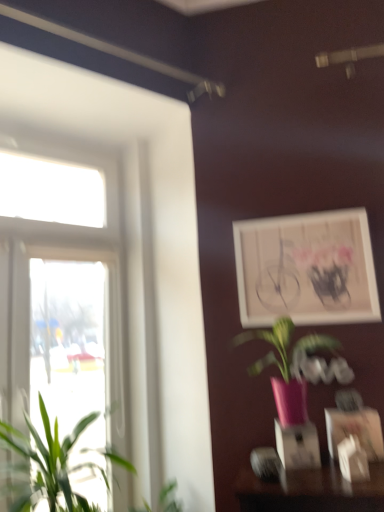
Describe the element at coordinates (295, 367) in the screenshot. I see `pink matte vase at center, marked as the 2th houseplant in a left-to-right arrangement` at that location.

Describe the element at coordinates (306, 269) in the screenshot. I see `white matte picture frame at upper right, the 1th picture frame in the back-to-front sequence` at that location.

The width and height of the screenshot is (384, 512). What are the coordinates of `clear glass window at left` in the screenshot? It's located at point(63,303).

Describe the element at coordinates (48, 464) in the screenshot. The image size is (384, 512). I see `green leafy plant at left, the 1th houseplant viewed from the left` at that location.

Where is `pink matte vase at center, marked as the 2th houseplant in a left-to-right arrangement`? pink matte vase at center, marked as the 2th houseplant in a left-to-right arrangement is located at coordinates pyautogui.click(x=295, y=367).

Is clear glass window at left in front of pink matte vase at center, the first houseplant in the right-to-left sequence?

No, clear glass window at left is further to the viewer.

Is clear glass window at left looking in the opposite direction of pink matte vase at center, the first houseplant in the right-to-left sequence?

No, pink matte vase at center, the first houseplant in the right-to-left sequence, is not at the back of clear glass window at left.

Looking at their sizes, would you say clear glass window at left is wider or thinner than pink matte vase at center, the first houseplant in the right-to-left sequence?

Clearly, clear glass window at left has less width compared to pink matte vase at center, the first houseplant in the right-to-left sequence.

From a real-world perspective, is pink matte vase at center, marked as the 2th houseplant in a left-to-right arrangement, located higher than green leafy plant at left, the 2th houseplant in the right-to-left sequence?

Yes, from a real-world perspective, pink matte vase at center, marked as the 2th houseplant in a left-to-right arrangement, is above green leafy plant at left, the 2th houseplant in the right-to-left sequence.

What's the angular difference between pink matte vase at center, marked as the 2th houseplant in a left-to-right arrangement, and green leafy plant at left, the 1th houseplant viewed from the left,'s facing directions?

The facing directions of pink matte vase at center, marked as the 2th houseplant in a left-to-right arrangement, and green leafy plant at left, the 1th houseplant viewed from the left, are 50.7 degrees apart.

Is the position of pink matte vase at center, the first houseplant in the right-to-left sequence, less distant than that of green leafy plant at left, the 2th houseplant in the right-to-left sequence?

No, pink matte vase at center, the first houseplant in the right-to-left sequence, is further to the viewer.

Does pink matte vase at center, marked as the 2th houseplant in a left-to-right arrangement, contain green leafy plant at left, the 2th houseplant in the right-to-left sequence?

That's incorrect, green leafy plant at left, the 2th houseplant in the right-to-left sequence, is not inside pink matte vase at center, marked as the 2th houseplant in a left-to-right arrangement.

Is matte white picture frame at lower right, arranged as the first picture frame when viewed from the front, behind pink matte vase at center, marked as the 2th houseplant in a left-to-right arrangement?

Yes, it is behind pink matte vase at center, marked as the 2th houseplant in a left-to-right arrangement.

Does matte white picture frame at lower right, marked as the second picture frame in a top-to-bottom arrangement, have a greater width compared to pink matte vase at center, marked as the 2th houseplant in a left-to-right arrangement?

Incorrect, the width of matte white picture frame at lower right, marked as the second picture frame in a top-to-bottom arrangement, does not surpass that of pink matte vase at center, marked as the 2th houseplant in a left-to-right arrangement.

Who is shorter, matte white picture frame at lower right, which is counted as the 2th picture frame, starting from the back, or pink matte vase at center, marked as the 2th houseplant in a left-to-right arrangement?

Standing shorter between the two is matte white picture frame at lower right, which is counted as the 2th picture frame, starting from the back.

From a real-world perspective, which is physically below, clear glass window at left or white matte picture frame at upper right, the second picture frame positioned from the bottom?

clear glass window at left, from a real-world perspective.

Is clear glass window at left looking in the opposite direction of white matte picture frame at upper right, the second picture frame positioned from the bottom?

No, white matte picture frame at upper right, the second picture frame positioned from the bottom, is not at the back of clear glass window at left.

Consider the image. How many degrees apart are the facing directions of clear glass window at left and white matte picture frame at upper right, the first picture frame positioned from the top?

The angular difference between clear glass window at left and white matte picture frame at upper right, the first picture frame positioned from the top, is 49.6 degrees.

Between clear glass window at left and white matte picture frame at upper right, the first picture frame positioned from the top, which one has larger size?

With larger size is clear glass window at left.

From a real-world perspective, is white matte picture frame at upper right, the first picture frame positioned from the top, located beneath pink matte vase at center, the first houseplant in the right-to-left sequence?

Incorrect, from a real-world perspective, white matte picture frame at upper right, the first picture frame positioned from the top, is higher than pink matte vase at center, the first houseplant in the right-to-left sequence.

From the picture: How many degrees apart are the facing directions of white matte picture frame at upper right, the 1th picture frame in the back-to-front sequence, and pink matte vase at center, marked as the 2th houseplant in a left-to-right arrangement?

The angular difference between white matte picture frame at upper right, the 1th picture frame in the back-to-front sequence, and pink matte vase at center, marked as the 2th houseplant in a left-to-right arrangement, is 1.17 degrees.

Between white matte picture frame at upper right, the second picture frame positioned from the bottom, and pink matte vase at center, marked as the 2th houseplant in a left-to-right arrangement, which one is positioned behind?

white matte picture frame at upper right, the second picture frame positioned from the bottom, is more distant.

Is point (287, 278) farther from viewer compared to point (306, 416)?

That is True.

Is matte white picture frame at lower right, placed as the first picture frame when sorted from bottom to top, further to camera compared to green leafy plant at left, the 2th houseplant in the right-to-left sequence?

Yes, matte white picture frame at lower right, placed as the first picture frame when sorted from bottom to top, is further from the camera.

Considering the relative sizes of matte white picture frame at lower right, marked as the second picture frame in a top-to-bottom arrangement, and green leafy plant at left, the 1th houseplant viewed from the left, in the image provided, is matte white picture frame at lower right, marked as the second picture frame in a top-to-bottom arrangement, bigger than green leafy plant at left, the 1th houseplant viewed from the left,?

Actually, matte white picture frame at lower right, marked as the second picture frame in a top-to-bottom arrangement, might be smaller than green leafy plant at left, the 1th houseplant viewed from the left.

Does matte white picture frame at lower right, arranged as the first picture frame when viewed from the front, have a lesser height compared to green leafy plant at left, the 1th houseplant viewed from the left?

Yes, matte white picture frame at lower right, arranged as the first picture frame when viewed from the front, is shorter than green leafy plant at left, the 1th houseplant viewed from the left.

From the matte white picture frame at lower right, marked as the second picture frame in a top-to-bottom arrangement, count the 2nd houseplant to the left and point to it. Please provide its 2D coordinates.

[(48, 464)]

Is pink matte vase at center, the first houseplant in the right-to-left sequence, to the right of white matte picture frame at upper right, the first picture frame positioned from the top, from the viewer's perspective?

In fact, pink matte vase at center, the first houseplant in the right-to-left sequence, is to the left of white matte picture frame at upper right, the first picture frame positioned from the top.

From a real-world perspective, starting from the white matte picture frame at upper right, the second picture frame positioned from the bottom, which houseplant is the 1st one below it? Please provide its 2D coordinates.

[(295, 367)]

Could you tell me if pink matte vase at center, the first houseplant in the right-to-left sequence, is turned towards white matte picture frame at upper right, the second picture frame positioned from the bottom?

No, pink matte vase at center, the first houseplant in the right-to-left sequence, is not oriented towards white matte picture frame at upper right, the second picture frame positioned from the bottom.

Is pink matte vase at center, the first houseplant in the right-to-left sequence, smaller than white matte picture frame at upper right, which is the 2th picture frame in front-to-back order?

Actually, pink matte vase at center, the first houseplant in the right-to-left sequence, might be larger than white matte picture frame at upper right, which is the 2th picture frame in front-to-back order.

This screenshot has height=512, width=384. What are the coordinates of `window above the pink matte vase at center, the first houseplant in the right-to-left sequence (from a real-world perspective)` in the screenshot? It's located at (63, 303).

The width and height of the screenshot is (384, 512). In the image, there is a green leafy plant at left, the 1th houseplant viewed from the left. What are the coordinates of `houseplant above it (from the image's perspective)` in the screenshot? It's located at (295, 367).

When comparing their distances from matte white picture frame at lower right, placed as the first picture frame when sorted from bottom to top, does white matte picture frame at upper right, the second picture frame positioned from the bottom, or pink matte vase at center, the first houseplant in the right-to-left sequence, seem closer?

pink matte vase at center, the first houseplant in the right-to-left sequence.

Looking at the image, which one is located further to pink matte vase at center, the first houseplant in the right-to-left sequence, matte white picture frame at lower right, which is counted as the 2th picture frame, starting from the back, or clear glass window at left?

clear glass window at left is further to pink matte vase at center, the first houseplant in the right-to-left sequence.

Estimate the real-world distances between objects in this image. Which object is closer to pink matte vase at center, the first houseplant in the right-to-left sequence, white matte picture frame at upper right, which is the 2th picture frame in front-to-back order, or matte white picture frame at lower right, arranged as the first picture frame when viewed from the front?

matte white picture frame at lower right, arranged as the first picture frame when viewed from the front, lies closer to pink matte vase at center, the first houseplant in the right-to-left sequence, than the other object.

Estimate the real-world distances between objects in this image. Which object is closer to clear glass window at left, green leafy plant at left, the 1th houseplant viewed from the left, or white matte picture frame at upper right, which is the 2th picture frame in front-to-back order?

green leafy plant at left, the 1th houseplant viewed from the left, is closer to clear glass window at left.

When comparing their distances from green leafy plant at left, the 2th houseplant in the right-to-left sequence, does clear glass window at left or pink matte vase at center, the first houseplant in the right-to-left sequence, seem further?

pink matte vase at center, the first houseplant in the right-to-left sequence.

Which object lies further to the anchor point pink matte vase at center, marked as the 2th houseplant in a left-to-right arrangement, white matte picture frame at upper right, the second picture frame positioned from the bottom, or green leafy plant at left, the 1th houseplant viewed from the left?

The object further to pink matte vase at center, marked as the 2th houseplant in a left-to-right arrangement, is green leafy plant at left, the 1th houseplant viewed from the left.

Consider the image. From the image, which object appears to be nearer to white matte picture frame at upper right, the first picture frame positioned from the top, matte white picture frame at lower right, placed as the first picture frame when sorted from bottom to top, or pink matte vase at center, marked as the 2th houseplant in a left-to-right arrangement?

The object closer to white matte picture frame at upper right, the first picture frame positioned from the top, is pink matte vase at center, marked as the 2th houseplant in a left-to-right arrangement.

Considering their positions, is pink matte vase at center, the first houseplant in the right-to-left sequence, positioned further to white matte picture frame at upper right, the 1th picture frame in the back-to-front sequence, than green leafy plant at left, the 1th houseplant viewed from the left?

green leafy plant at left, the 1th houseplant viewed from the left, lies further to white matte picture frame at upper right, the 1th picture frame in the back-to-front sequence, than the other object.

At what (x,y) coordinates should I click in order to perform the action: click on houseplant between white matte picture frame at upper right, which is the 2th picture frame in front-to-back order, and matte white picture frame at lower right, marked as the second picture frame in a top-to-bottom arrangement, in the vertical direction. Please return your answer as a coordinate pair (x, y). This screenshot has width=384, height=512. Looking at the image, I should click on (295, 367).

Locate an element on the screen. This screenshot has width=384, height=512. houseplant situated between green leafy plant at left, the 2th houseplant in the right-to-left sequence, and white matte picture frame at upper right, which is the 2th picture frame in front-to-back order, from left to right is located at coordinates (295, 367).

The image size is (384, 512). I want to click on houseplant between clear glass window at left and pink matte vase at center, the first houseplant in the right-to-left sequence, from left to right, so click(48, 464).

Find the location of a particular element. The image size is (384, 512). picture frame located between clear glass window at left and matte white picture frame at lower right, arranged as the first picture frame when viewed from the front, in the left-right direction is located at coordinates (306, 269).